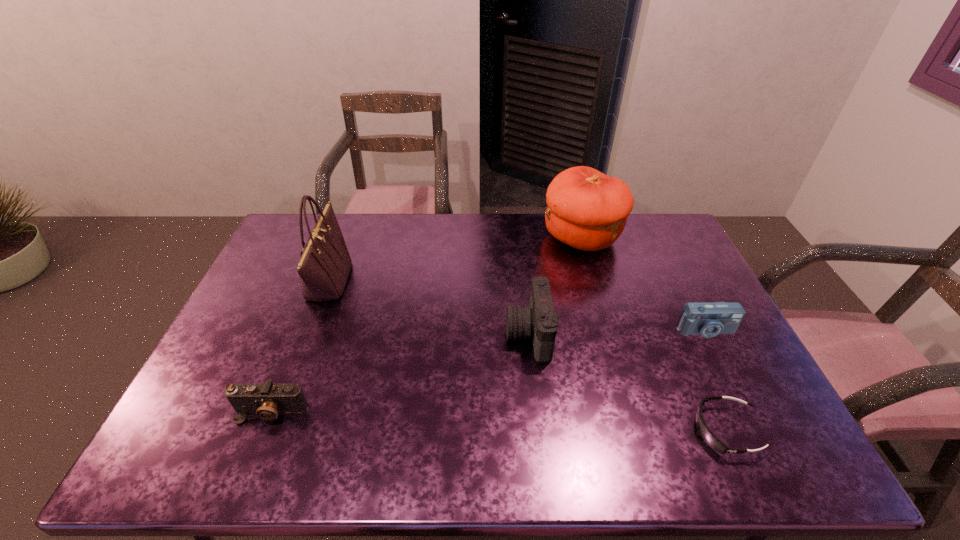
The width and height of the screenshot is (960, 540). What are the coordinates of `object that is the fourth closest to the handbag` in the screenshot? It's located at (709, 438).

At what (x,y) coordinates should I click in order to perform the action: click on camera identified as the closest to the tallest object. Please return your answer as a coordinate pair (x, y). Looking at the image, I should click on 267,400.

Find the location of a particular element. The image size is (960, 540). camera that stands as the second closest to the fourth shortest object is located at coordinates (267, 400).

Locate an element on the screen. The width and height of the screenshot is (960, 540). blank space that satisfies the following two spatial constraints: 1. at the lens of the tallest camera; 2. on the front-facing side of the leftmost camera is located at coordinates (538, 412).

Find the location of `vacant point that satisfies the following two spatial constraints: 1. on the lens of the rightmost camera; 2. on the front and sides of the goggles`. vacant point that satisfies the following two spatial constraints: 1. on the lens of the rightmost camera; 2. on the front and sides of the goggles is located at coordinates (754, 430).